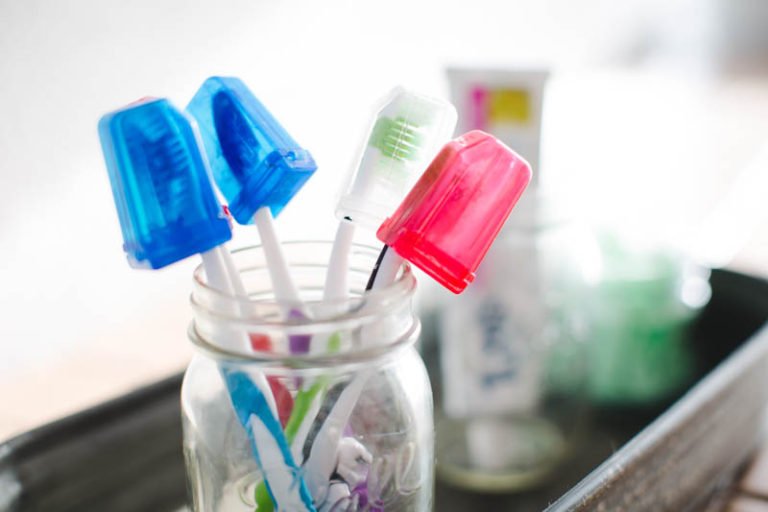
Where is `five toothbrushes`? five toothbrushes is located at coordinates (216, 270), (239, 288), (275, 260), (339, 263), (391, 268).